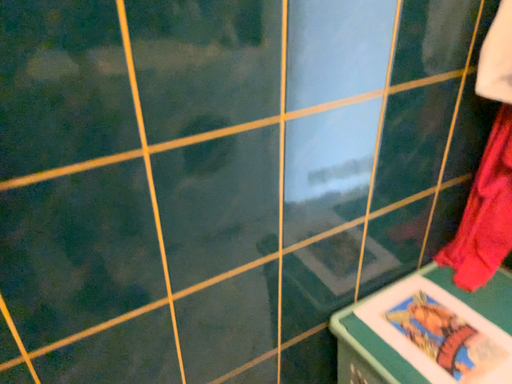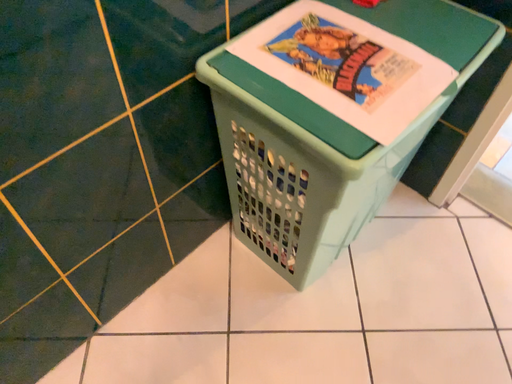
Question: How did the camera likely rotate when shooting the video?

Choices:
 (A) rotated left
 (B) rotated right

Answer: (B)